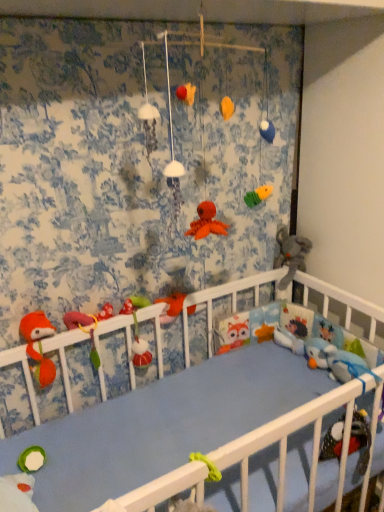
Question: Is gray plush elephant at right, positioned as the 6th toy in left-to-right order, positioned behind fuzzy fabric toy at center, acting as the 4th toy starting from the right?

Choices:
 (A) no
 (B) yes

Answer: (B)

Question: Can we say gray plush elephant at right, positioned as the 6th toy in left-to-right order, lies outside fuzzy fabric toy at center, acting as the 4th toy starting from the right?

Choices:
 (A) yes
 (B) no

Answer: (A)

Question: Considering the relative positions of gray plush elephant at right, the 1th toy when ordered from right to left, and fuzzy fabric toy at center, which is the 3th toy in left-to-right order, in the image provided, is gray plush elephant at right, the 1th toy when ordered from right to left, in front of fuzzy fabric toy at center, which is the 3th toy in left-to-right order,?

Choices:
 (A) no
 (B) yes

Answer: (A)

Question: Can you confirm if gray plush elephant at right, positioned as the 6th toy in left-to-right order, is taller than fuzzy fabric toy at center, acting as the 4th toy starting from the right?

Choices:
 (A) no
 (B) yes

Answer: (A)

Question: From the image's perspective, is gray plush elephant at right, the 1th toy when ordered from right to left, below fuzzy fabric toy at center, acting as the 4th toy starting from the right?

Choices:
 (A) yes
 (B) no

Answer: (B)

Question: Can you confirm if gray plush elephant at right, the 1th toy when ordered from right to left, is thinner than fuzzy fabric toy at center, acting as the 4th toy starting from the right?

Choices:
 (A) no
 (B) yes

Answer: (A)

Question: From a real-world perspective, is matte green plush toy at center, marked as the second toy in a left-to-right arrangement, located beneath matte orange plush at center, which is counted as the fourth toy, starting from the left?

Choices:
 (A) no
 (B) yes

Answer: (A)

Question: Considering the relative sizes of matte green plush toy at center, marked as the second toy in a left-to-right arrangement, and matte orange plush at center, which is counted as the fourth toy, starting from the left, in the image provided, is matte green plush toy at center, marked as the second toy in a left-to-right arrangement, taller than matte orange plush at center, which is counted as the fourth toy, starting from the left,?

Choices:
 (A) yes
 (B) no

Answer: (A)

Question: Does matte green plush toy at center, marked as the second toy in a left-to-right arrangement, have a smaller size compared to matte orange plush at center, which is counted as the fourth toy, starting from the left?

Choices:
 (A) yes
 (B) no

Answer: (B)

Question: Can you confirm if matte green plush toy at center, which is counted as the 5th toy, starting from the right, is shorter than matte orange plush at center, which ranks as the third toy in right-to-left order?

Choices:
 (A) no
 (B) yes

Answer: (A)

Question: Is matte orange plush at center, which is counted as the fourth toy, starting from the left, surrounded by matte green plush toy at center, marked as the second toy in a left-to-right arrangement?

Choices:
 (A) no
 (B) yes

Answer: (A)

Question: Could you tell me if matte green plush toy at center, marked as the second toy in a left-to-right arrangement, is facing matte orange plush at center, which is counted as the fourth toy, starting from the left?

Choices:
 (A) no
 (B) yes

Answer: (A)

Question: From the image's perspective, is blue plush toy at right, the fifth toy when ordered from left to right, located beneath fluffy orange fox at left, placed as the 1th toy when sorted from left to right?

Choices:
 (A) no
 (B) yes

Answer: (B)